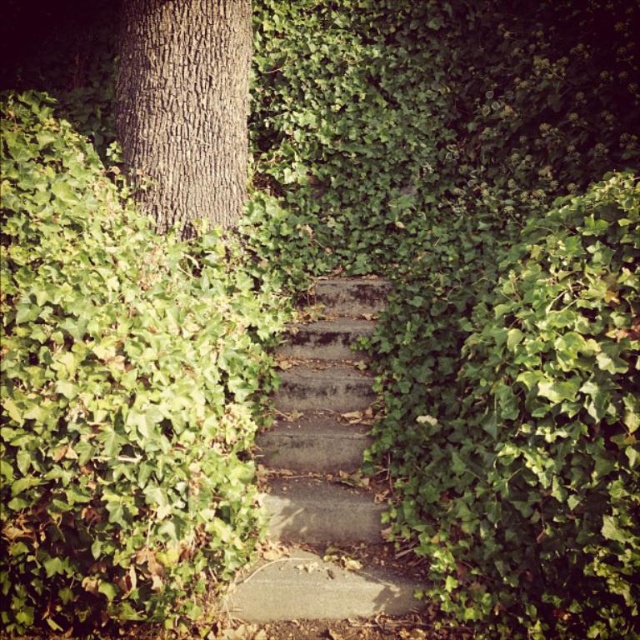
You are a painter wanting to paint the scene. You need to know which object is wider between the concrete steps at center and the smooth brown bark at upper left. Could you tell me which one is wider?

The concrete steps at center is wider than the smooth brown bark at upper left according to the description.

You are standing at the entrance of the garden and want to reach the gazebo located at the center of the garden. The concrete steps at center are in your way. Can you walk around them to reach the gazebo?

The concrete steps at center are positioned at point (321, 474), so yes, you can walk around them to reach the gazebo as they are not blocking your path entirely.